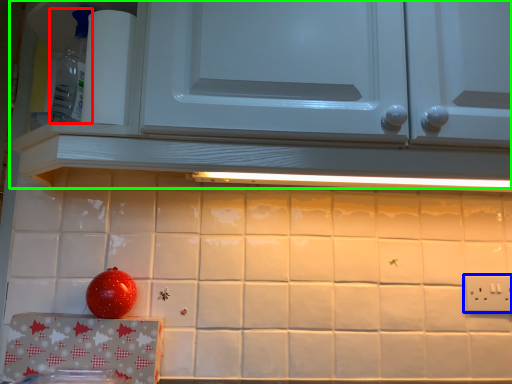
Question: Estimate the real-world distances between objects in this image. Which object is closer to appliance (highlighted by a red box), electric outlet (highlighted by a blue box) or cabinetry (highlighted by a green box)?

Choices:
 (A) electric outlet
 (B) cabinetry

Answer: (B)